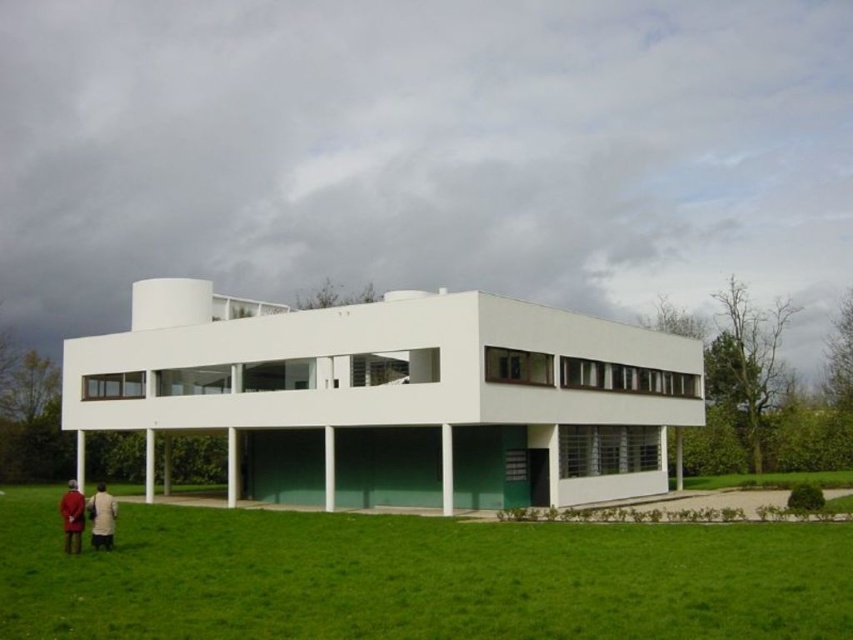
You are standing in front of the modernist building and see two coats at the lower left. Which coat is closer to you, the light beige coat at lower left or the red wool coat at lower left?

The light beige coat at lower left is closer to you because it is in front of the red wool coat at lower left.

You are standing at the camera position looking at the modernist building. There are two points marked in the image. The first point is at coordinate point (9, 570) and the second is at point (102, 497). Which point is closer to you?

Point (9, 570) is in front of point (102, 497), so it is closer to you.